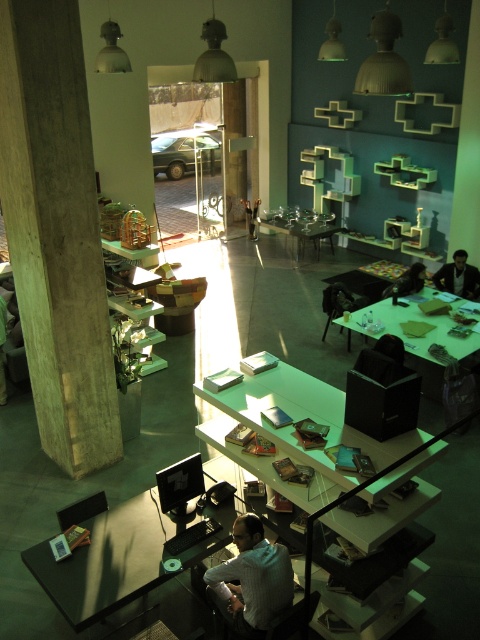
Who is higher up, white glossy table at center or black leather chair at upper right?

Positioned higher is black leather chair at upper right.

Is white glossy table at center further to the viewer compared to black leather chair at upper right?

No.

Identify the location of white glossy table at center. This screenshot has height=640, width=480. (300, 419).

Can you confirm if dark brown leather jacket at right is smaller than clear glass table at center?

Yes.

Between dark brown leather jacket at right and clear glass table at center, which one appears on the left side from the viewer's perspective?

From the viewer's perspective, clear glass table at center appears more on the left side.

Does point (459, 268) lie in front of point (297, 248)?

Yes.

Where is `dark brown leather jacket at right`? The image size is (480, 640). dark brown leather jacket at right is located at coordinates (457, 276).

Can you confirm if dark brown shirt at lower center is taller than black leather chair at upper right?

Correct, dark brown shirt at lower center is much taller as black leather chair at upper right.

Which is behind, point (250, 621) or point (383, 292)?

The point (383, 292) is more distant.

Describe the element at coordinates (252, 580) in the screenshot. The height and width of the screenshot is (640, 480). I see `dark brown shirt at lower center` at that location.

Where is `dark brown shirt at lower center`? The image size is (480, 640). dark brown shirt at lower center is located at coordinates (252, 580).